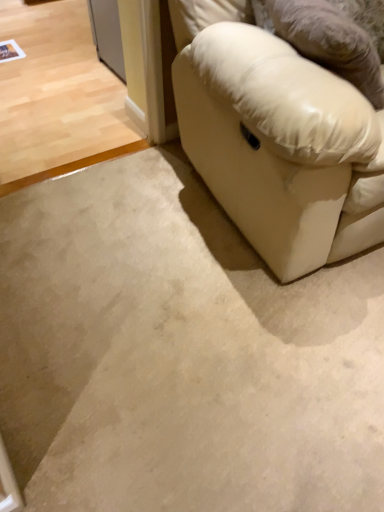
Question: Does leather-like beige pillow at right have a lesser width compared to beige carpet at lower left, positioned as the 1th concrete in top-to-bottom order?

Choices:
 (A) yes
 (B) no

Answer: (A)

Question: Is leather-like beige pillow at right closer to the viewer compared to beige carpet at lower left, which is the second concrete in bottom-to-top order?

Choices:
 (A) yes
 (B) no

Answer: (A)

Question: Can you confirm if leather-like beige pillow at right is shorter than beige carpet at lower left, which is the first concrete from back to front?

Choices:
 (A) no
 (B) yes

Answer: (A)

Question: Is leather-like beige pillow at right facing towards beige carpet at lower left, the second concrete from the front?

Choices:
 (A) no
 (B) yes

Answer: (A)

Question: From the image's perspective, would you say leather-like beige pillow at right is positioned over beige carpet at lower left, positioned as the 1th concrete in top-to-bottom order?

Choices:
 (A) yes
 (B) no

Answer: (B)

Question: Looking at their shapes, would you say beige carpet at lower left, positioned as the 1th concrete in top-to-bottom order, is wider or thinner than leather-like beige pillow at right?

Choices:
 (A) wide
 (B) thin

Answer: (A)

Question: From the image's perspective, is beige carpet at lower left, positioned as the 1th concrete in top-to-bottom order, above or below leather-like beige pillow at right?

Choices:
 (A) below
 (B) above

Answer: (B)

Question: Does point (44, 38) appear closer or farther from the camera than point (238, 108)?

Choices:
 (A) farther
 (B) closer

Answer: (A)

Question: Is beige carpet at lower left, which is the second concrete in bottom-to-top order, taller or shorter than leather-like beige pillow at right?

Choices:
 (A) short
 (B) tall

Answer: (A)

Question: From the image's perspective, is white leather couch at lower right located above or below beige carpet at lower left, which is the second concrete in bottom-to-top order?

Choices:
 (A) above
 (B) below

Answer: (B)

Question: In terms of size, does white leather couch at lower right appear bigger or smaller than beige carpet at lower left, which is the first concrete from back to front?

Choices:
 (A) small
 (B) big

Answer: (B)

Question: Considering the positions of white leather couch at lower right and beige carpet at lower left, which is the first concrete from back to front, in the image, is white leather couch at lower right taller or shorter than beige carpet at lower left, which is the first concrete from back to front,?

Choices:
 (A) tall
 (B) short

Answer: (A)

Question: Do you think white leather couch at lower right is within beige carpet at lower left, which is the second concrete in bottom-to-top order, or outside of it?

Choices:
 (A) inside
 (B) outside

Answer: (B)

Question: Is leather-like beige pillow at right to the left or to the right of white leather couch at lower right in the image?

Choices:
 (A) left
 (B) right

Answer: (A)

Question: Is leather-like beige pillow at right situated inside white leather couch at lower right or outside?

Choices:
 (A) inside
 (B) outside

Answer: (A)